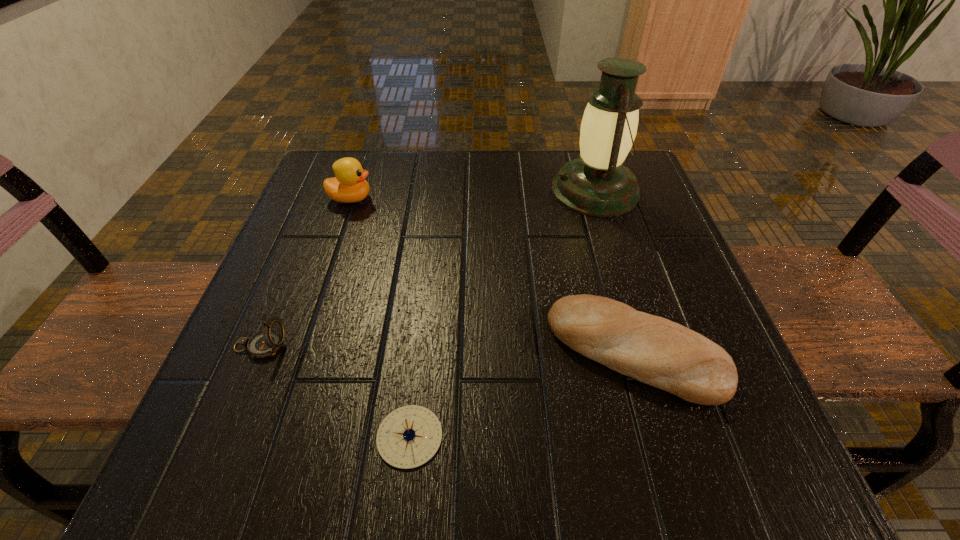
You are a GUI agent. You are given a task and a screenshot of the screen. Output one action in this format:
    pyautogui.click(x=<x>, y=<y>)
    Task: Click on the bread that is at the right edge
    
    Given the screenshot: What is the action you would take?
    pyautogui.click(x=653, y=350)

The image size is (960, 540). Identify the location of object situated at the far left corner. (349, 185).

I want to click on object that is at the far right corner, so click(597, 183).

In the image, there is a desktop. Find the location of `vacant space at the far edge`. vacant space at the far edge is located at coordinates (465, 150).

Locate an element on the screen. The image size is (960, 540). vacant region at the near edge of the desktop is located at coordinates pyautogui.click(x=457, y=475).

Locate an element on the screen. The image size is (960, 540). free space at the left edge is located at coordinates (229, 412).

This screenshot has height=540, width=960. What are the coordinates of `vacant space at the right edge of the desktop` in the screenshot? It's located at (688, 412).

At what (x,y) coordinates should I click in order to perform the action: click on blank space at the far left corner of the desktop. Please return your answer as a coordinate pair (x, y). The image size is (960, 540). Looking at the image, I should click on (335, 152).

What are the coordinates of `free space at the near left corner of the desktop` in the screenshot? It's located at (304, 435).

Where is `free spot between the farther compass and the lantern`? Image resolution: width=960 pixels, height=540 pixels. free spot between the farther compass and the lantern is located at coordinates (428, 268).